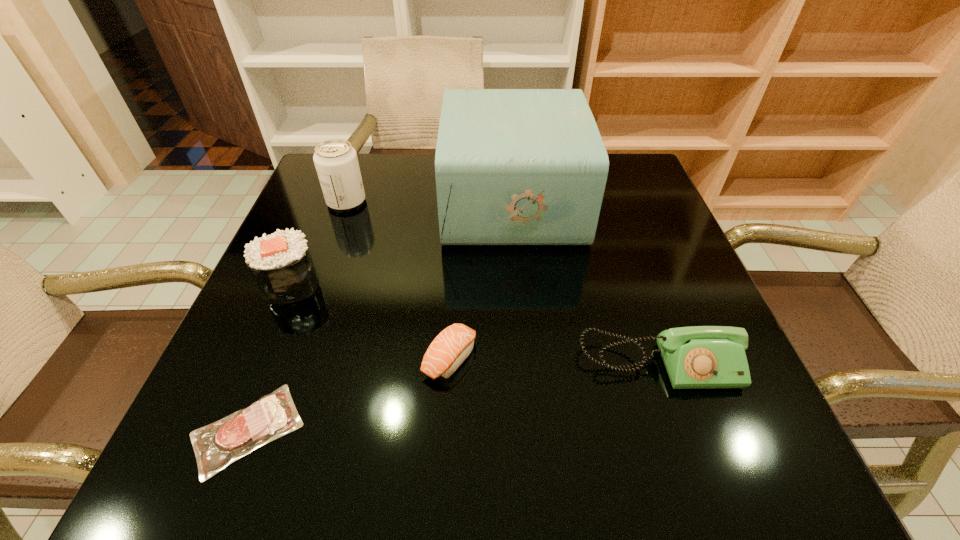
This screenshot has width=960, height=540. I want to click on unoccupied position between the shorter sushi and the shortest object, so click(x=348, y=394).

The image size is (960, 540). I want to click on empty space between the telephone and the radio receiver, so click(586, 282).

Identify the location of empty space between the shortest object and the second tallest object. (297, 316).

Locate an element on the screen. This screenshot has width=960, height=540. empty location between the fourth tallest object and the radio receiver is located at coordinates (586, 282).

Where is `vacant region between the fifth tallest object and the left sushi`? vacant region between the fifth tallest object and the left sushi is located at coordinates (371, 321).

Where is `vacant area between the right sushi and the left sushi`? vacant area between the right sushi and the left sushi is located at coordinates (371, 321).

At what (x,y) coordinates should I click in order to perform the action: click on free area in between the fifth shortest object and the taller sushi. Please return your answer as a coordinate pair (x, y). Looking at the image, I should click on (319, 243).

The width and height of the screenshot is (960, 540). In order to click on free space between the second tallest object and the second shortest object in this screenshot , I will do `click(398, 280)`.

The height and width of the screenshot is (540, 960). I want to click on free area in between the steak and the left sushi, so click(269, 357).

You are a GUI agent. You are given a task and a screenshot of the screen. Output one action in this format:
    pyautogui.click(x=<x>, y=<y>)
    Task: Click on the object that is the closest to the taller sushi
    The image size is (960, 540).
    Given the screenshot: What is the action you would take?
    pyautogui.click(x=217, y=445)